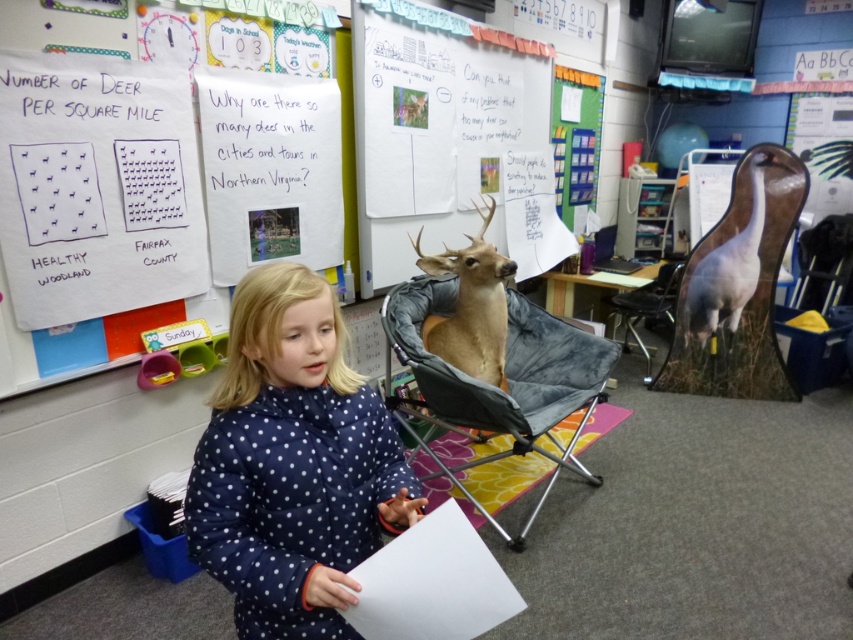
You are a student in the classroom and need to write something on the whiteboard at upper center. Can you reach it from your current position near the gray fabric folding chair at center?

The whiteboard at upper center is larger in size than the gray fabric folding chair at center, but this detail does not indicate the height of the whiteboard. Without information about the whiteboard height or your own reach, it is impossible to determine if you can reach it.

You are a student in the classroom and want to move from the navy polka dot coat at center to the gray fabric folding chair at center. Is there enough space between them for you to walk through comfortably?

The navy polka dot coat at center and gray fabric folding chair at center are 4.39 feet apart, which is more than enough space for a student to walk through comfortably.